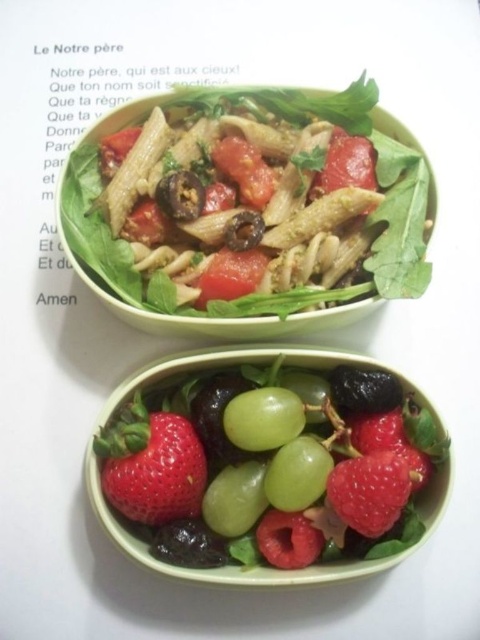
Does green matte grape at center have a lesser height compared to red matte strawberry at lower right?

No.

Is green matte grape at center taller than red matte strawberry at lower right?

Yes.

Which is behind, point (225, 422) or point (355, 474)?

The point (225, 422) is more distant.

Find the location of a particular element. The height and width of the screenshot is (640, 480). green matte grape at center is located at coordinates (264, 461).

Is green matte pasta salad at upper center taller than green matte grape at center?

Indeed, green matte pasta salad at upper center has a greater height compared to green matte grape at center.

From the picture: Between green matte pasta salad at upper center and green matte grape at center, which one has more height?

Standing taller between the two is green matte pasta salad at upper center.

Is point (282, 189) in front of point (320, 492)?

That is False.

The height and width of the screenshot is (640, 480). I want to click on green matte pasta salad at upper center, so click(250, 211).

Who is more forward, [316,100] or [393,518]?

Point [393,518]

Is point (197, 150) positioned after point (385, 484)?

Yes, point (197, 150) is farther from viewer.

Between point (228, 225) and point (360, 500), which one is positioned in front?

Point (360, 500)

Where is `green matte pasta salad at upper center`? green matte pasta salad at upper center is located at coordinates click(x=250, y=211).